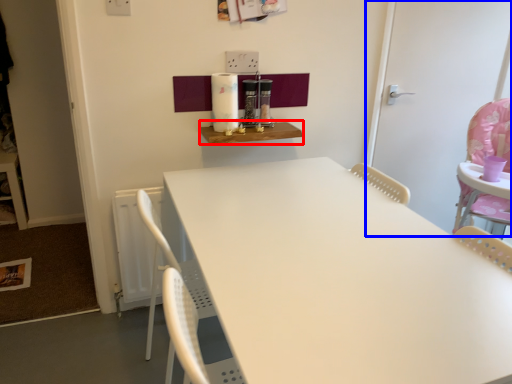
Question: Which object appears closest to the camera in this image, table (highlighted by a red box) or door (highlighted by a blue box)?

Choices:
 (A) table
 (B) door

Answer: (A)